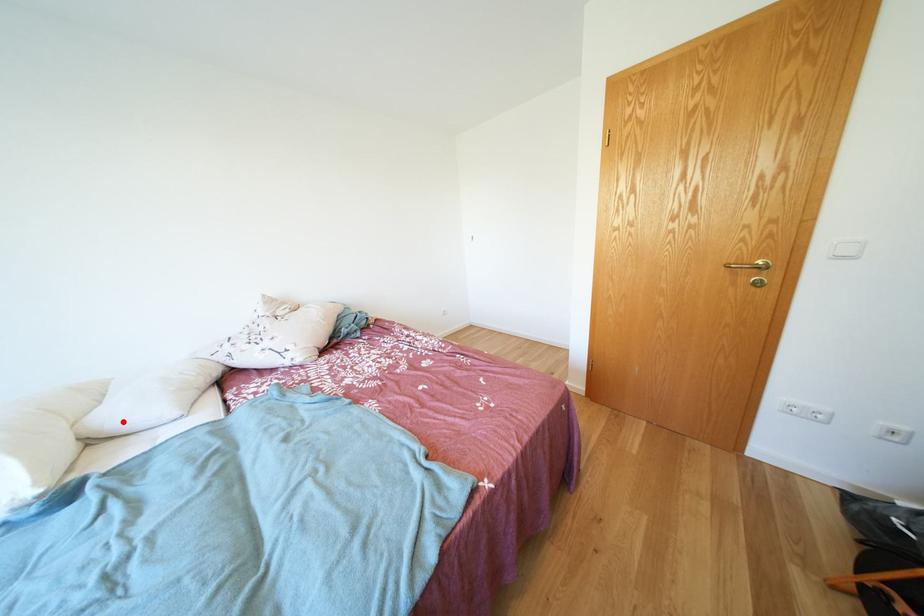
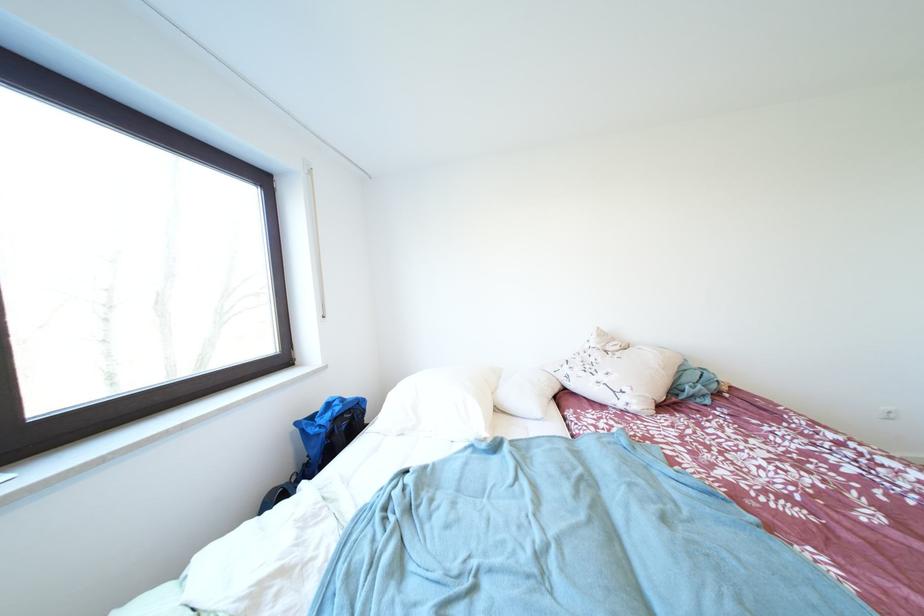
Find the pixel in the second image that matches the highlighted location in the first image.

(517, 403)